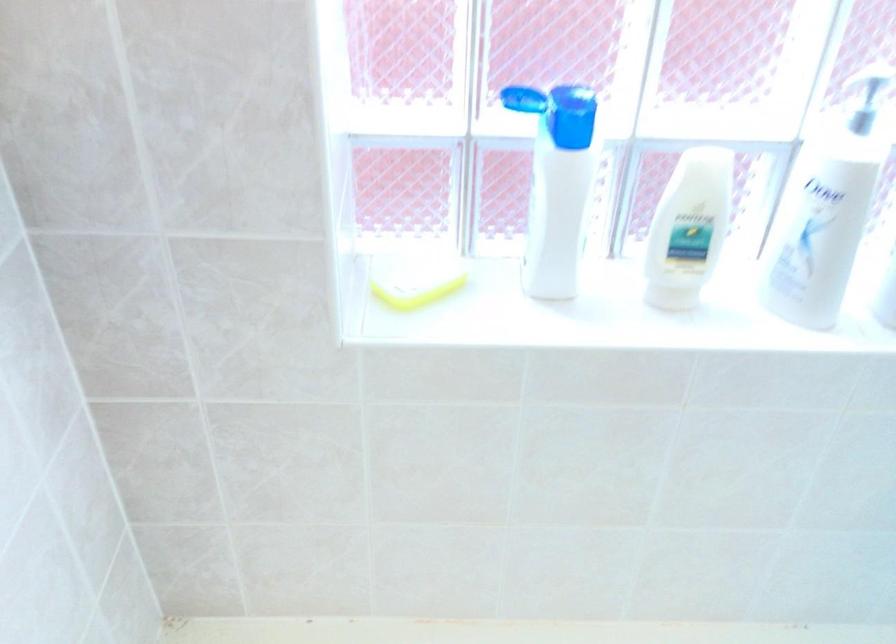
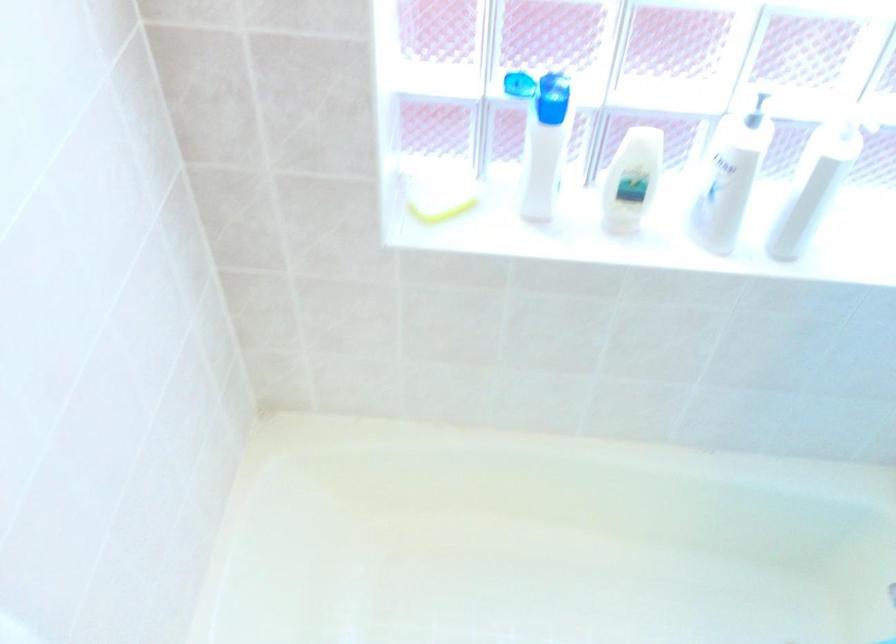
Question: The images are taken continuously from a first-person perspective. In which direction are you moving?

Choices:
 (A) Left
 (B) Right
 (C) Forward
 (D) Backward

Answer: (D)